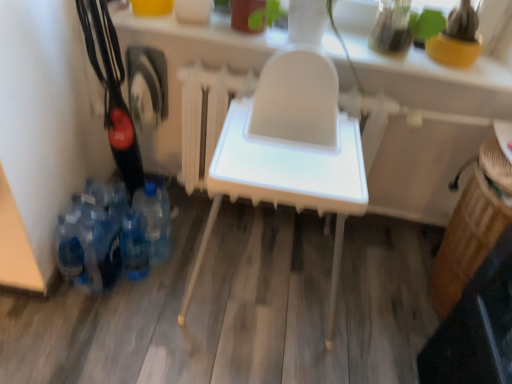
In order to click on free spot in front of blue plastic bottles at lower left, which ranks as the first bottle in left-to-right order in this screenshot , I will do `click(76, 321)`.